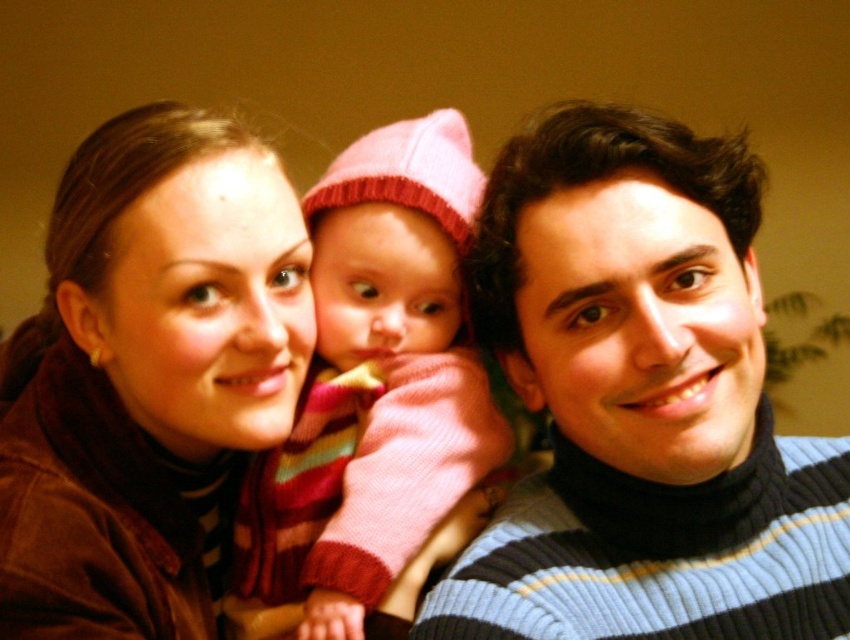
In order to click on striped knit sweater at center in this screenshot , I will do `click(641, 403)`.

Is point (786, 577) farther from camera compared to point (350, 408)?

No, it is in front of (350, 408).

Between point (826, 500) and point (369, 195), which one is positioned in front?

Point (826, 500)

Where is `striped knit sweater at center`? The width and height of the screenshot is (850, 640). striped knit sweater at center is located at coordinates (641, 403).

Describe the element at coordinates (641, 403) in the screenshot. I see `striped knit sweater at center` at that location.

Locate an element on the screen. striped knit sweater at center is located at coordinates (641, 403).

Which is in front, point (159, 179) or point (412, 438)?

Positioned in front is point (159, 179).

Can you confirm if brown suede jacket at left is positioned to the right of pink knitted hat at center?

In fact, brown suede jacket at left is to the left of pink knitted hat at center.

You are a GUI agent. You are given a task and a screenshot of the screen. Output one action in this format:
    pyautogui.click(x=<x>, y=<y>)
    Task: Click on the brown suede jacket at left
    This screenshot has height=640, width=850.
    Given the screenshot: What is the action you would take?
    pyautogui.click(x=146, y=378)